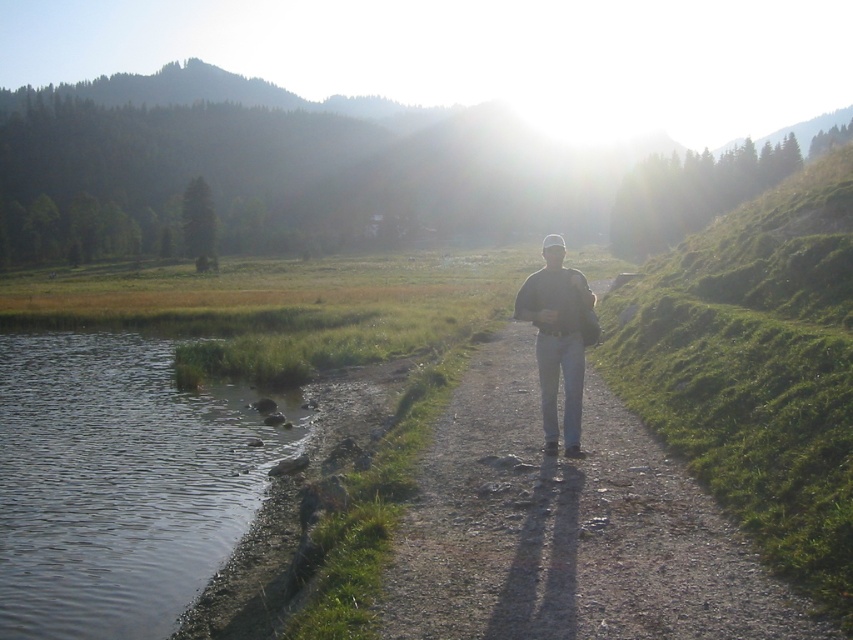
You are standing on the dirt path and want to walk to the gray cotton shirt at center. Is the green grassy hillside at center blocking your path?

The green grassy hillside at center might be wider than gray cotton shirt at center, so there is a possibility that the hillside could be blocking the path. However, since the shirt is at the center, it might be on the hillside itself or slightly offset. Without exact measurements, it is uncertain if the hillside is wide enough to block the path completely.

From the picture: You are standing at the point marked by the coordinates point (334, 172) in the image. What type of terrain are you currently standing on?

The point (334, 172) corresponds to the green grassy hillside at center, so you are standing on grassy terrain.